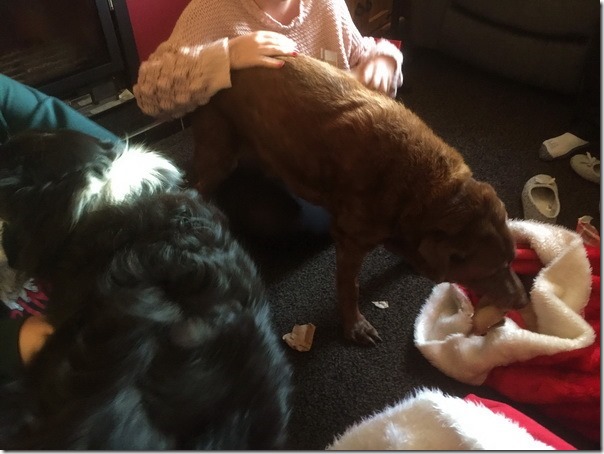
This screenshot has height=454, width=604. I want to click on two christmas stockings on floor, so click(550, 339), click(457, 439).